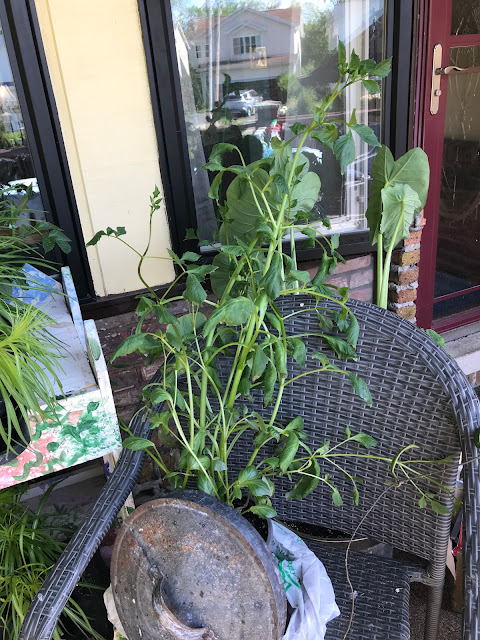
Locate an element on the screen. This screenshot has width=480, height=640. door handle is located at coordinates (438, 70).